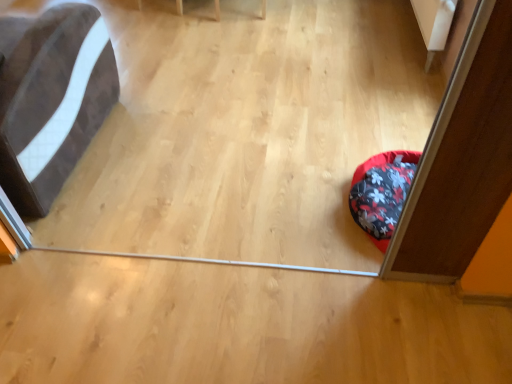
What do you see at coordinates (53, 102) in the screenshot? I see `matte brown sofa at left` at bounding box center [53, 102].

This screenshot has width=512, height=384. I want to click on matte brown sofa at left, so click(53, 102).

Where is `matte brown sofa at left`? matte brown sofa at left is located at coordinates (53, 102).